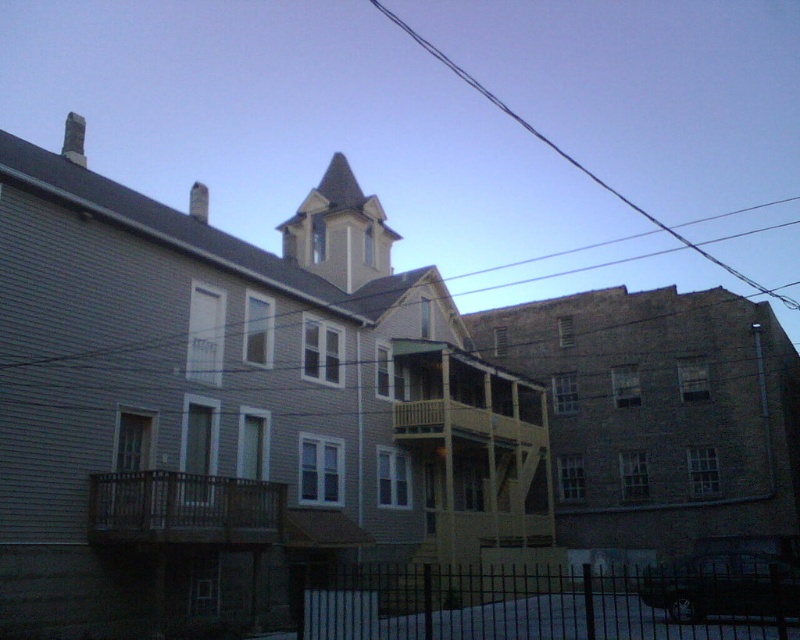
Which of these two, gray siding church at center or brown brick church at center, stands taller?

gray siding church at center

Does gray siding church at center appear on the left side of brown brick church at center?

Yes, gray siding church at center is to the left of brown brick church at center.

Measure the distance between point (x=24, y=474) and camera.

Point (x=24, y=474) is 65.58 feet from camera.

Find the location of `gray siding church at center`. gray siding church at center is located at coordinates (232, 406).

Which is in front, point (776, 524) or point (434, 49)?

Positioned in front is point (776, 524).

Does brown brick church at center have a lesser height compared to black wire at upper center?

Yes, brown brick church at center is shorter than black wire at upper center.

Between point (628, 509) and point (694, 244), which one is positioned behind?

Point (694, 244)

Identify the location of brown brick church at center. (660, 416).

How far apart are gray siding church at center and black wire at upper center?

173.26 meters

Is point (482, 384) more distant than point (466, 72)?

No, it is in front of (466, 72).

Between point (449, 506) and point (566, 157), which one is positioned behind?

Positioned behind is point (566, 157).

Where is `gray siding church at center`? This screenshot has width=800, height=640. gray siding church at center is located at coordinates (232, 406).